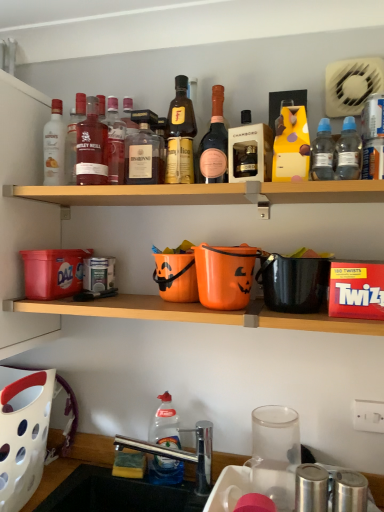
Question: Considering the positions of matte white bottle at upper left, which is the first bottle from left to right, and clear plastic bottle at upper right, arranged as the third bottle when viewed from the right, in the image, is matte white bottle at upper left, which is the first bottle from left to right, wider or thinner than clear plastic bottle at upper right, arranged as the third bottle when viewed from the right,?

Choices:
 (A) wide
 (B) thin

Answer: (A)

Question: Relative to clear plastic bottle at upper right, arranged as the third bottle when viewed from the right, is matte white bottle at upper left, the eleventh bottle positioned from the right, in front or behind?

Choices:
 (A) front
 (B) behind

Answer: (B)

Question: Which of these objects is positioned closest to the white plastic basket at lower left?

Choices:
 (A) matte white bottle at upper left, which is the first bottle from left to right
 (B) matte glass bottle at center, the 5th bottle positioned from the left
 (C) clear plastic bottle at upper right, arranged as the third bottle when viewed from the right
 (D) matte red glass bottles at upper center, which is counted as the eighth bottle, starting from the right
 (E) wooden shelf at upper center

Answer: (E)

Question: Considering the real-world distances, which object is farthest from the matte glass bottle at center, which ranks as the 7th bottle in right-to-left order?

Choices:
 (A) matte white bottle at upper left, which is the first bottle from left to right
 (B) matte red glass bottles at upper center, which is the fourth bottle in left-to-right order
 (C) white plastic can at upper right, acting as the eleventh bottle starting from the left
 (D) matte glass bottle at upper left, which ranks as the tenth bottle in right-to-left order
 (E) matte glass bottle at upper left, the third bottle when ordered from left to right

Answer: (C)